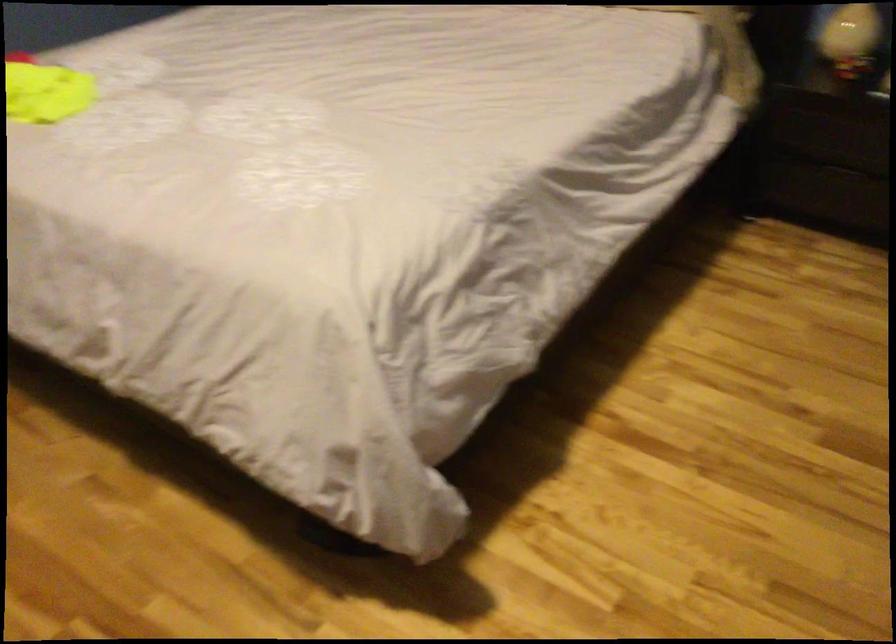
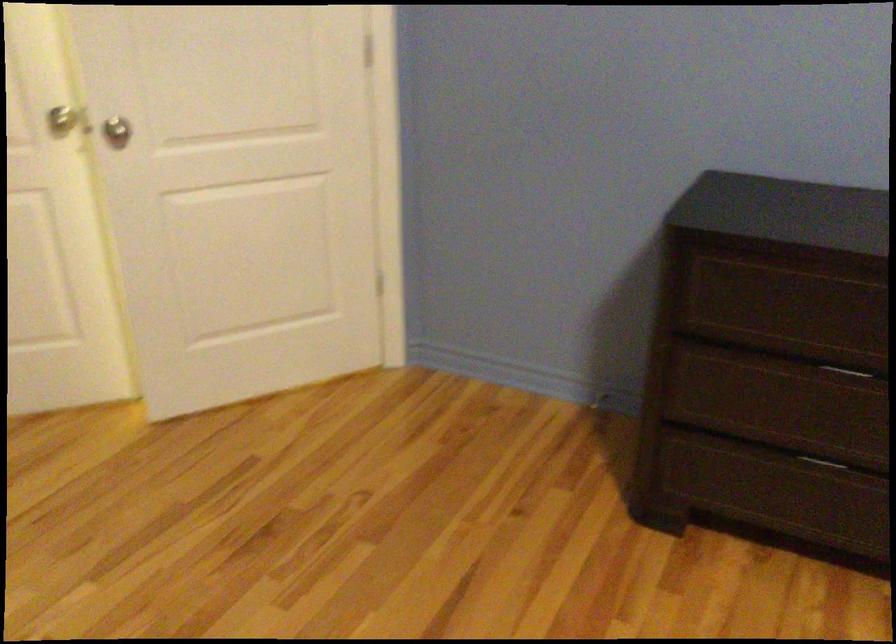
The images are taken continuously from a first-person perspective. In which direction is your viewpoint rotating?

The camera rotated toward left-down.